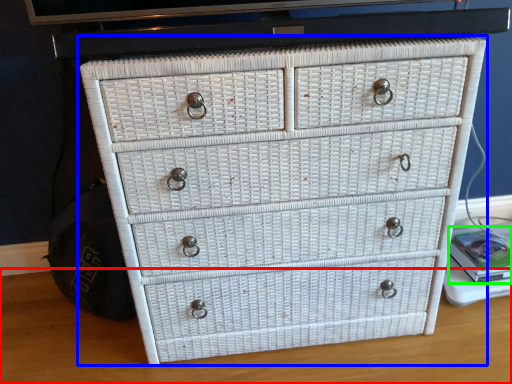
Question: Which is nearer to the table top (highlighted by a red box)? chest of drawers (highlighted by a blue box) or book (highlighted by a green box).

Choices:
 (A) chest of drawers
 (B) book

Answer: (A)